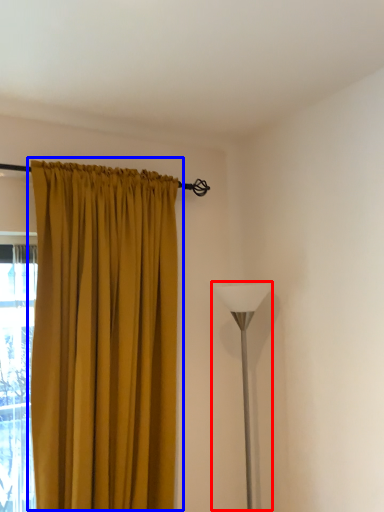
Question: Which point is closer to the camera, table lamp (highlighted by a red box) or curtain (highlighted by a blue box)?

Choices:
 (A) table lamp
 (B) curtain

Answer: (B)